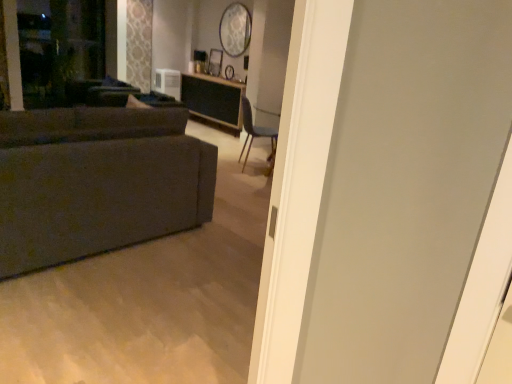
Find the location of a particular element. free space in front of textured gray couch at left is located at coordinates (96, 309).